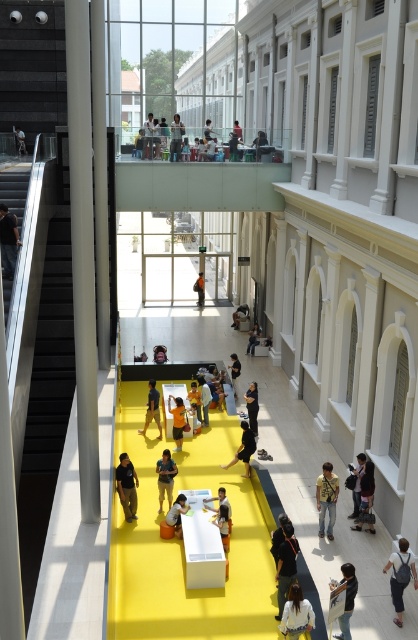
Question: Among these points, which one is farthest from the camera?

Choices:
 (A) (143, 426)
 (B) (397, 605)

Answer: (A)

Question: In this image, where is light brown wooden chair at upper center located relative to black fabric bag at center?

Choices:
 (A) right
 (B) left

Answer: (B)

Question: Which of these objects is positioned closest to the light brown wooden table at center?

Choices:
 (A) dark gray fabric jacket at lower center
 (B) black fabric pants at center
 (C) white fabric shirt at lower center

Answer: (A)

Question: Which of the following is the farthest from the observer?

Choices:
 (A) orange fabric bag at center
 (B) light brown leather jacket at center
 (C) khaki cotton pants at center
 (D) black fabric pants at center

Answer: (A)

Question: Does white fabric shirt at lower center appear on the left side of dark blue jeans at center?

Choices:
 (A) no
 (B) yes

Answer: (A)

Question: Is dark gray backpack at lower right bigger than matte black person at upper left?

Choices:
 (A) no
 (B) yes

Answer: (A)